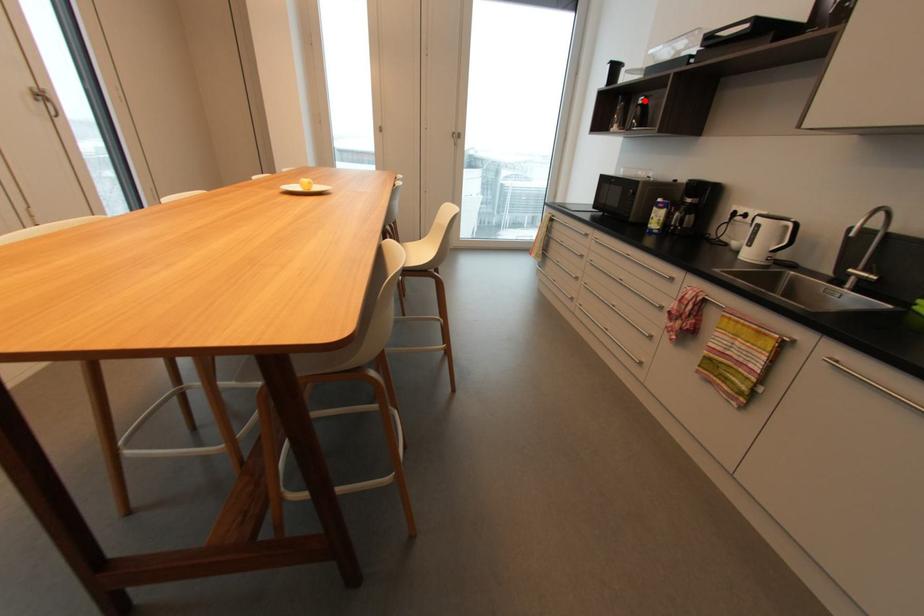
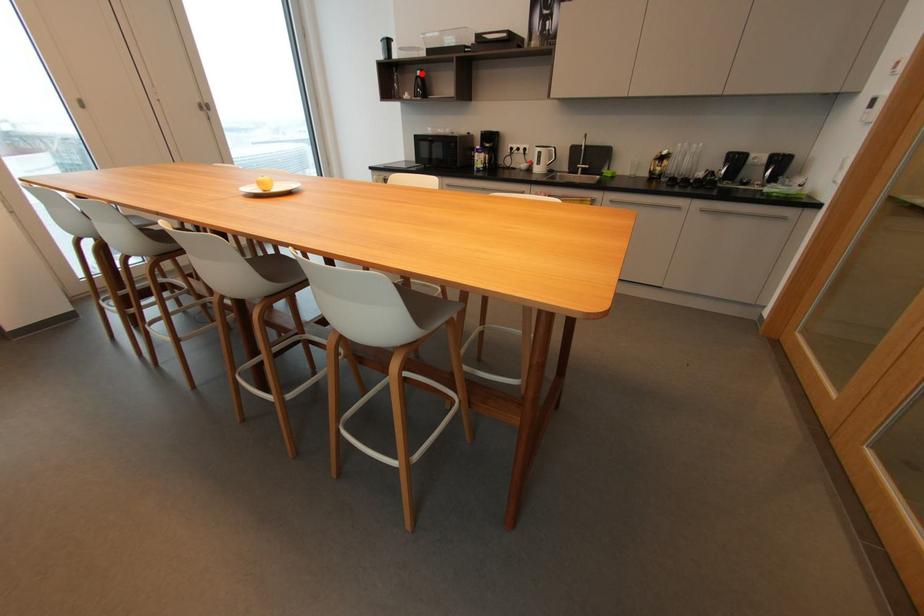
I am providing you with two images of the same scene from different viewpoints. A red point is marked on the first image and another point is marked on the second image. Is the marked point in image1 the same physical position as the marked point in image2?

Yes